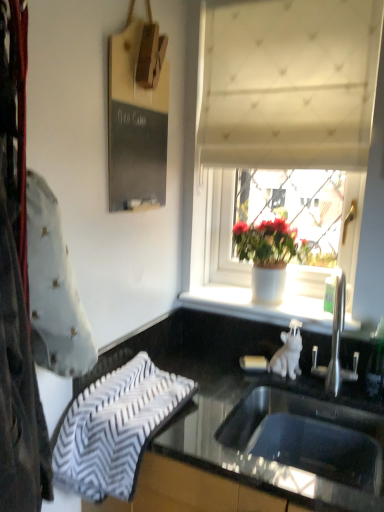
Question: Is white textured curtain at upper center taller than white zigzag-patterned towel at lower left?

Choices:
 (A) no
 (B) yes

Answer: (B)

Question: Is white textured curtain at upper center closer to camera compared to white zigzag-patterned towel at lower left?

Choices:
 (A) no
 (B) yes

Answer: (A)

Question: Would you say white zigzag-patterned towel at lower left is part of white textured curtain at upper center's contents?

Choices:
 (A) no
 (B) yes

Answer: (A)

Question: Does white textured curtain at upper center turn towards white zigzag-patterned towel at lower left?

Choices:
 (A) no
 (B) yes

Answer: (B)

Question: Is white textured curtain at upper center to the left of white zigzag-patterned towel at lower left from the viewer's perspective?

Choices:
 (A) yes
 (B) no

Answer: (B)

Question: Does point (109, 180) appear closer or farther from the camera than point (233, 226)?

Choices:
 (A) farther
 (B) closer

Answer: (B)

Question: From their relative heights in the image, would you say black chalkboard at upper left is taller or shorter than white matte pot at center?

Choices:
 (A) tall
 (B) short

Answer: (A)

Question: Is black chalkboard at upper left wider or thinner than white matte pot at center?

Choices:
 (A) thin
 (B) wide

Answer: (A)

Question: Is black chalkboard at upper left to the left or to the right of white matte pot at center in the image?

Choices:
 (A) right
 (B) left

Answer: (B)

Question: In the image, is black glossy countertop at lower center positioned in front of or behind white textured curtain at upper center?

Choices:
 (A) behind
 (B) front

Answer: (B)

Question: From a real-world perspective, is black glossy countertop at lower center physically located above or below white textured curtain at upper center?

Choices:
 (A) below
 (B) above

Answer: (A)

Question: Would you say black glossy countertop at lower center is to the left or to the right of white textured curtain at upper center in the picture?

Choices:
 (A) right
 (B) left

Answer: (B)

Question: Does point (292, 468) appear closer or farther from the camera than point (324, 146)?

Choices:
 (A) farther
 (B) closer

Answer: (B)

Question: Does point (379, 439) appear closer or farther from the camera than point (273, 116)?

Choices:
 (A) closer
 (B) farther

Answer: (A)

Question: In the image, is stainless steel sink at lower center positioned in front of or behind white textured curtain at upper center?

Choices:
 (A) behind
 (B) front

Answer: (B)